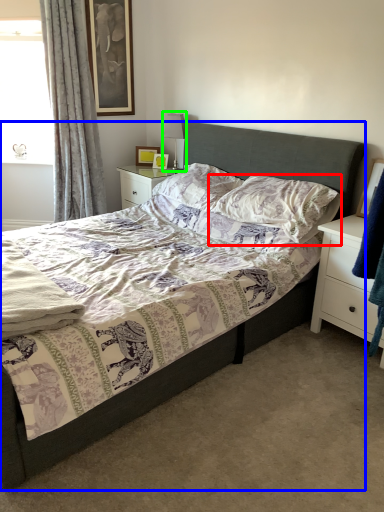
Question: Based on their relative distances, which object is nearer to pillow (highlighted by a red box)? Choose from bed (highlighted by a blue box) and table lamp (highlighted by a green box).

Choices:
 (A) bed
 (B) table lamp

Answer: (A)